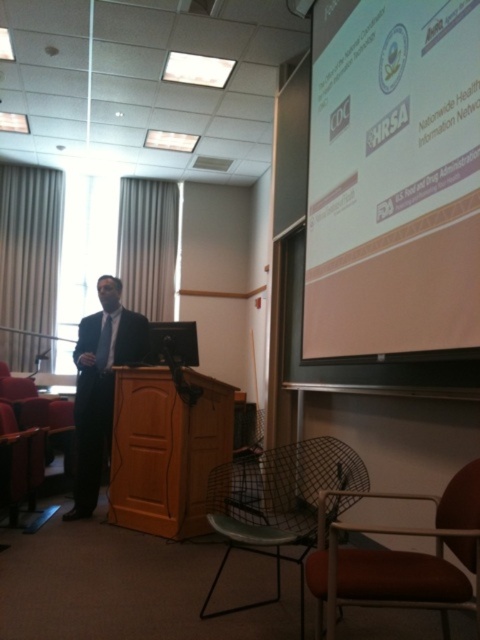
Question: Can you confirm if wooden podium at center is positioned above green mesh chair at lower center?

Choices:
 (A) yes
 (B) no

Answer: (A)

Question: Can you confirm if green mesh chair at lower center is wider than matte black tie at left?

Choices:
 (A) no
 (B) yes

Answer: (B)

Question: Which of the following is the closest to the observer?

Choices:
 (A) matte black tie at left
 (B) wooden podium at center
 (C) white matte projection screen at upper right
 (D) orange fabric chair at lower right

Answer: (D)

Question: Based on their relative distances, which object is nearer to the matte black tie at left?

Choices:
 (A) leather seat at lower left
 (B) wooden podium at center

Answer: (B)

Question: Which of the following is the farthest from the observer?

Choices:
 (A) (299, 556)
 (B) (383, 342)
 (C) (167, 492)

Answer: (C)

Question: Does white matte projection screen at upper right lie behind matte black tie at left?

Choices:
 (A) yes
 (B) no

Answer: (B)